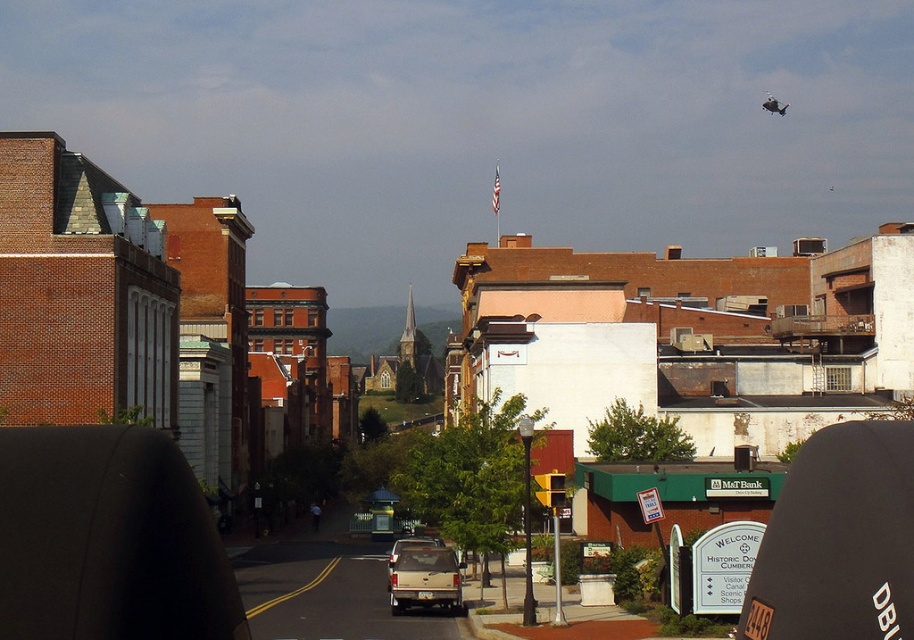
Looking at this image, who is higher up, beige matte truck at center or matte white truck at center?

Positioned higher is beige matte truck at center.

Is point (399, 589) less distant than point (397, 554)?

Yes, it is in front of point (397, 554).

Image resolution: width=914 pixels, height=640 pixels. What are the coordinates of `beige matte truck at center` in the screenshot? It's located at (424, 579).